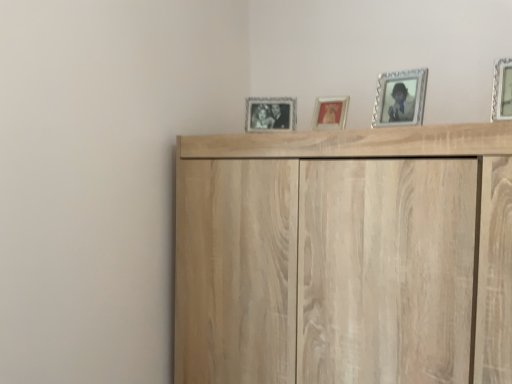
Find the location of `black and white photo frame at center, the first picture frame positioned from the left`. black and white photo frame at center, the first picture frame positioned from the left is located at coordinates (270, 114).

Measure the distance between silver metallic picture frame at upper right, which is counted as the 1th picture frame, starting from the front, and camera.

silver metallic picture frame at upper right, which is counted as the 1th picture frame, starting from the front, and camera are 93.57 centimeters apart from each other.

Identify the location of silver metallic picture frame at upper right, which is counted as the 1th picture frame, starting from the front. The height and width of the screenshot is (384, 512). (502, 90).

Measure the distance between metallic silver picture frame at center, which is the 2th picture frame from left to right, and camera.

3.79 feet.

In order to click on metallic silver picture frame at center, the third picture frame positioned from the right in this screenshot , I will do `click(330, 113)`.

The width and height of the screenshot is (512, 384). I want to click on silver textured picture frame at upper right, acting as the second picture frame starting from the front, so click(400, 98).

Looking at this image, is black and white photo frame at center, arranged as the first picture frame when viewed from the back, facing towards light wood cupboard at upper center?

No, black and white photo frame at center, arranged as the first picture frame when viewed from the back, does not turn towards light wood cupboard at upper center.

From a real-world perspective, starting from the light wood cupboard at upper center, which picture frame is the 2nd one vertically above it? Please provide its 2D coordinates.

[(270, 114)]

Considering the sizes of black and white photo frame at center, the fourth picture frame in the right-to-left sequence, and light wood cupboard at upper center in the image, is black and white photo frame at center, the fourth picture frame in the right-to-left sequence, taller or shorter than light wood cupboard at upper center?

Considering their sizes, black and white photo frame at center, the fourth picture frame in the right-to-left sequence, has less height than light wood cupboard at upper center.

Is black and white photo frame at center, the first picture frame positioned from the left, facing towards silver textured picture frame at upper right, which is counted as the 3th picture frame, starting from the back?

No, black and white photo frame at center, the first picture frame positioned from the left, does not turn towards silver textured picture frame at upper right, which is counted as the 3th picture frame, starting from the back.

From the image's perspective, which one is positioned higher, black and white photo frame at center, the first picture frame positioned from the left, or silver textured picture frame at upper right, which is counted as the 3th picture frame, starting from the back?

silver textured picture frame at upper right, which is counted as the 3th picture frame, starting from the back.

Where is `the 2nd picture frame to the right of the black and white photo frame at center, arranged as the first picture frame when viewed from the back, counting from the anchor's position`? the 2nd picture frame to the right of the black and white photo frame at center, arranged as the first picture frame when viewed from the back, counting from the anchor's position is located at coordinates (400, 98).

Are black and white photo frame at center, the fourth picture frame in the right-to-left sequence, and silver textured picture frame at upper right, which is the second picture frame in right-to-left order, far apart?

black and white photo frame at center, the fourth picture frame in the right-to-left sequence, is near silver textured picture frame at upper right, which is the second picture frame in right-to-left order, not far away.

What are the coordinates of `cupboard below the metallic silver picture frame at center, the 3th picture frame from the front (from the image's perspective)` in the screenshot? It's located at (345, 256).

Is metallic silver picture frame at center, the third picture frame positioned from the right, not within light wood cupboard at upper center?

Yes.

Is metallic silver picture frame at center, the 3th picture frame from the front, facing towards light wood cupboard at upper center?

No, metallic silver picture frame at center, the 3th picture frame from the front, is not turned towards light wood cupboard at upper center.

From the image's perspective, which one is positioned higher, metallic silver picture frame at center, which is the 2th picture frame from left to right, or light wood cupboard at upper center?

metallic silver picture frame at center, which is the 2th picture frame from left to right, from the image's perspective.

Relative to black and white photo frame at center, the first picture frame positioned from the left, is metallic silver picture frame at center, which is the 2th picture frame from left to right, in front or behind?

metallic silver picture frame at center, which is the 2th picture frame from left to right, is in front of black and white photo frame at center, the first picture frame positioned from the left.

From the image's perspective, does metallic silver picture frame at center, the 3th picture frame from the front, appear lower than black and white photo frame at center, the first picture frame positioned from the left?

Indeed, from the image's perspective, metallic silver picture frame at center, the 3th picture frame from the front, is shown beneath black and white photo frame at center, the first picture frame positioned from the left.

Can you tell me how much metallic silver picture frame at center, which is the 2th picture frame from left to right, and black and white photo frame at center, arranged as the first picture frame when viewed from the back, differ in facing direction?

The angular difference between metallic silver picture frame at center, which is the 2th picture frame from left to right, and black and white photo frame at center, arranged as the first picture frame when viewed from the back, is 0.0261 degrees.

Considering the relative positions of metallic silver picture frame at center, which is the 2th picture frame from left to right, and black and white photo frame at center, the first picture frame positioned from the left, in the image provided, is metallic silver picture frame at center, which is the 2th picture frame from left to right, to the left of black and white photo frame at center, the first picture frame positioned from the left, from the viewer's perspective?

Incorrect, metallic silver picture frame at center, which is the 2th picture frame from left to right, is not on the left side of black and white photo frame at center, the first picture frame positioned from the left.

Is silver metallic picture frame at upper right, which is counted as the 1th picture frame, starting from the front, oriented away from silver textured picture frame at upper right, which is the second picture frame in right-to-left order?

No, silver metallic picture frame at upper right, which is counted as the 1th picture frame, starting from the front, is not facing the opposite direction of silver textured picture frame at upper right, which is the second picture frame in right-to-left order.

Which is more to the left, silver metallic picture frame at upper right, which ranks as the first picture frame in right-to-left order, or silver textured picture frame at upper right, marked as the third picture frame in a left-to-right arrangement?

Positioned to the left is silver textured picture frame at upper right, marked as the third picture frame in a left-to-right arrangement.

From the picture: From the image's perspective, is silver metallic picture frame at upper right, which is counted as the 1th picture frame, starting from the front, above or below silver textured picture frame at upper right, acting as the second picture frame starting from the front?

From the image's perspective, silver metallic picture frame at upper right, which is counted as the 1th picture frame, starting from the front, appears above silver textured picture frame at upper right, acting as the second picture frame starting from the front.

Can you confirm if silver metallic picture frame at upper right, the 4th picture frame from the back, is smaller than silver textured picture frame at upper right, which is the second picture frame in right-to-left order?

Actually, silver metallic picture frame at upper right, the 4th picture frame from the back, might be larger than silver textured picture frame at upper right, which is the second picture frame in right-to-left order.

How different are the orientations of light wood cupboard at upper center and metallic silver picture frame at center, which is the 2th picture frame from left to right, in degrees?

2.05 degrees separate the facing orientations of light wood cupboard at upper center and metallic silver picture frame at center, which is the 2th picture frame from left to right.

In the scene shown: Does light wood cupboard at upper center have a greater width compared to metallic silver picture frame at center, the 2th picture frame positioned from the back?

Yes.

From a real-world perspective, does light wood cupboard at upper center stand above metallic silver picture frame at center, the 2th picture frame positioned from the back?

No, from a real-world perspective, light wood cupboard at upper center is not over metallic silver picture frame at center, the 2th picture frame positioned from the back

Which is more to the left, silver metallic picture frame at upper right, which is counted as the 1th picture frame, starting from the front, or light wood cupboard at upper center?

From the viewer's perspective, light wood cupboard at upper center appears more on the left side.

Looking at this image, from the image's perspective, which one is positioned higher, silver metallic picture frame at upper right, which is the fourth picture frame from left to right, or light wood cupboard at upper center?

silver metallic picture frame at upper right, which is the fourth picture frame from left to right, appears higher in the image.

From their relative heights in the image, would you say silver metallic picture frame at upper right, which is the fourth picture frame from left to right, is taller or shorter than light wood cupboard at upper center?

In the image, silver metallic picture frame at upper right, which is the fourth picture frame from left to right, appears to be shorter than light wood cupboard at upper center.

Which object is more forward, silver metallic picture frame at upper right, which ranks as the first picture frame in right-to-left order, or light wood cupboard at upper center?

light wood cupboard at upper center is more forward.

This screenshot has height=384, width=512. In order to click on the 4th picture frame behind when counting from the light wood cupboard at upper center in this screenshot , I will do `click(270, 114)`.

From the silver textured picture frame at upper right, which is the second picture frame in right-to-left order, count the 2nd picture frame to the left and point to it. Please provide its 2D coordinates.

[(270, 114)]

From the picture: Looking at the image, which one is located further to black and white photo frame at center, the 4th picture frame viewed from the front, metallic silver picture frame at center, the third picture frame positioned from the right, or silver metallic picture frame at upper right, the 4th picture frame from the back?

silver metallic picture frame at upper right, the 4th picture frame from the back, is positioned further to the anchor black and white photo frame at center, the 4th picture frame viewed from the front.

Estimate the real-world distances between objects in this image. Which object is further from black and white photo frame at center, the first picture frame positioned from the left, metallic silver picture frame at center, the 3th picture frame from the front, or light wood cupboard at upper center?

The object further to black and white photo frame at center, the first picture frame positioned from the left, is light wood cupboard at upper center.

Estimate the real-world distances between objects in this image. Which object is closer to light wood cupboard at upper center, black and white photo frame at center, the 4th picture frame viewed from the front, or silver textured picture frame at upper right, which is the second picture frame in right-to-left order?

silver textured picture frame at upper right, which is the second picture frame in right-to-left order, is positioned closer to the anchor light wood cupboard at upper center.

Estimate the real-world distances between objects in this image. Which object is further from silver metallic picture frame at upper right, which is the fourth picture frame from left to right, light wood cupboard at upper center or metallic silver picture frame at center, the 3th picture frame from the front?

light wood cupboard at upper center is positioned further to the anchor silver metallic picture frame at upper right, which is the fourth picture frame from left to right.

Considering their positions, is silver metallic picture frame at upper right, which is counted as the 1th picture frame, starting from the front, positioned further to black and white photo frame at center, arranged as the first picture frame when viewed from the back, than metallic silver picture frame at center, which is the 2th picture frame from left to right?

Among the two, silver metallic picture frame at upper right, which is counted as the 1th picture frame, starting from the front, is located further to black and white photo frame at center, arranged as the first picture frame when viewed from the back.

When comparing their distances from silver textured picture frame at upper right, marked as the third picture frame in a left-to-right arrangement, does silver metallic picture frame at upper right, which is counted as the 1th picture frame, starting from the front, or metallic silver picture frame at center, the third picture frame positioned from the right, seem closer?

Result: metallic silver picture frame at center, the third picture frame positioned from the right, is positioned closer to the anchor silver textured picture frame at upper right, marked as the third picture frame in a left-to-right arrangement.

Looking at the image, which one is located further to metallic silver picture frame at center, the 2th picture frame positioned from the back, silver textured picture frame at upper right, which is counted as the 3th picture frame, starting from the back, or black and white photo frame at center, the 4th picture frame viewed from the front?

silver textured picture frame at upper right, which is counted as the 3th picture frame, starting from the back, is positioned further to the anchor metallic silver picture frame at center, the 2th picture frame positioned from the back.

Considering their positions, is silver textured picture frame at upper right, which is the second picture frame in right-to-left order, positioned further to silver metallic picture frame at upper right, which ranks as the first picture frame in right-to-left order, than metallic silver picture frame at center, which is the 2th picture frame from left to right?

Based on the image, metallic silver picture frame at center, which is the 2th picture frame from left to right, appears to be further to silver metallic picture frame at upper right, which ranks as the first picture frame in right-to-left order.

Where is `picture frame between black and white photo frame at center, the 4th picture frame viewed from the front, and light wood cupboard at upper center vertically`? The image size is (512, 384). picture frame between black and white photo frame at center, the 4th picture frame viewed from the front, and light wood cupboard at upper center vertically is located at coordinates (330, 113).

Locate an element on the screen. picture frame between black and white photo frame at center, arranged as the first picture frame when viewed from the back, and silver textured picture frame at upper right, marked as the third picture frame in a left-to-right arrangement, from left to right is located at coordinates (330, 113).

Identify the location of picture frame between metallic silver picture frame at center, the third picture frame positioned from the right, and silver metallic picture frame at upper right, which is counted as the 1th picture frame, starting from the front. The width and height of the screenshot is (512, 384). (400, 98).